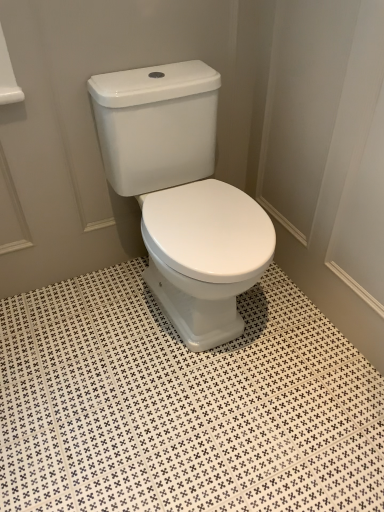
At what (x,y) coordinates should I click in order to perform the action: click on vacant area in front of white glossy toilet at center. Please return your answer as a coordinate pair (x, y). Looking at the image, I should click on (184, 421).